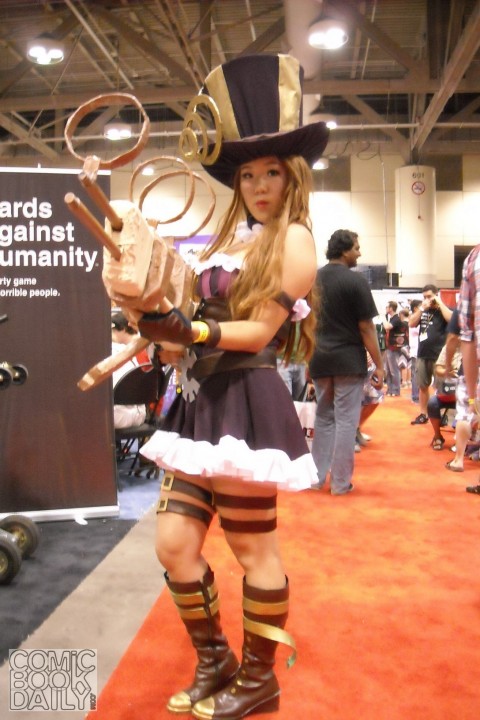
You are a GUI agent. You are given a task and a screenshot of the screen. Output one action in this format:
    pyautogui.click(x=<x>, y=<y>)
    Task: Click on the light
    This screenshot has height=720, width=480.
    Given the screenshot: What is the action you would take?
    pyautogui.click(x=39, y=58), pyautogui.click(x=117, y=129), pyautogui.click(x=151, y=166), pyautogui.click(x=339, y=39), pyautogui.click(x=335, y=127), pyautogui.click(x=323, y=165)